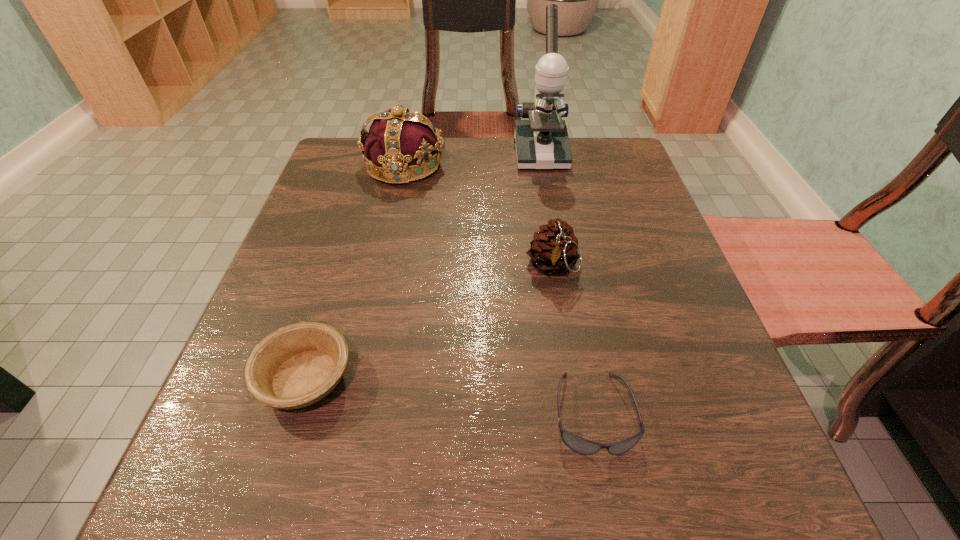
Where is `microscope`? microscope is located at coordinates (542, 142).

The width and height of the screenshot is (960, 540). In order to click on the fourth shortest object in this screenshot , I will do `click(398, 143)`.

At what (x,y) coordinates should I click in order to perform the action: click on pinecone. Please return your answer as a coordinate pair (x, y). Looking at the image, I should click on (554, 250).

You are a GUI agent. You are given a task and a screenshot of the screen. Output one action in this format:
    pyautogui.click(x=<x>, y=<y>)
    Task: Click on the third farthest object
    Image resolution: width=960 pixels, height=540 pixels.
    Given the screenshot: What is the action you would take?
    pyautogui.click(x=554, y=250)

The height and width of the screenshot is (540, 960). What are the coordinates of `the fourth tallest object` in the screenshot? It's located at (297, 365).

Locate an element on the screen. The width and height of the screenshot is (960, 540). sunglasses is located at coordinates (578, 444).

You are a GUI agent. You are given a task and a screenshot of the screen. Output one action in this format:
    pyautogui.click(x=<x>, y=<y>)
    Task: Click on the vacant point located 0.110m at the eyepiece of the tallest object
    This screenshot has width=960, height=540.
    Given the screenshot: What is the action you would take?
    pyautogui.click(x=548, y=199)

At what (x,y) coordinates should I click in order to perform the action: click on free spot located on the right of the crown. Please return your answer as a coordinate pair (x, y). This screenshot has height=540, width=960. Looking at the image, I should click on (510, 165).

Where is `vacant space situated with a leaf charm attached to the third tallest object`? The width and height of the screenshot is (960, 540). vacant space situated with a leaf charm attached to the third tallest object is located at coordinates (584, 463).

Where is `vacant region located on the back of the second shortest object`? The width and height of the screenshot is (960, 540). vacant region located on the back of the second shortest object is located at coordinates (345, 253).